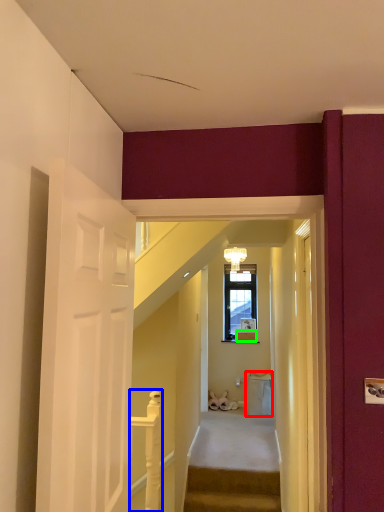
Question: Considering the real-world distances, which object is farthest from trash bin/can (highlighted by a red box)? balustrade (highlighted by a blue box) or box (highlighted by a green box)?

Choices:
 (A) balustrade
 (B) box

Answer: (A)